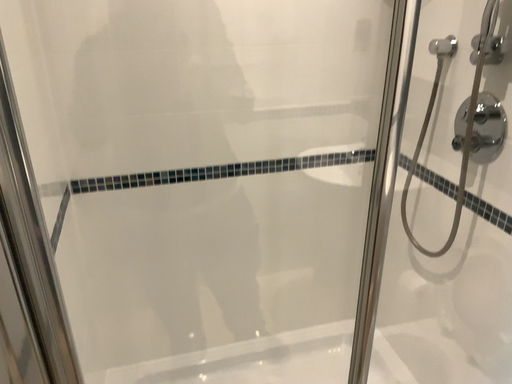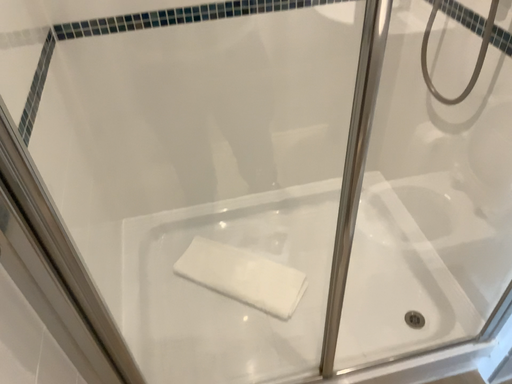
Question: Which way did the camera rotate in the video?

Choices:
 (A) rotated upward
 (B) rotated downward

Answer: (B)